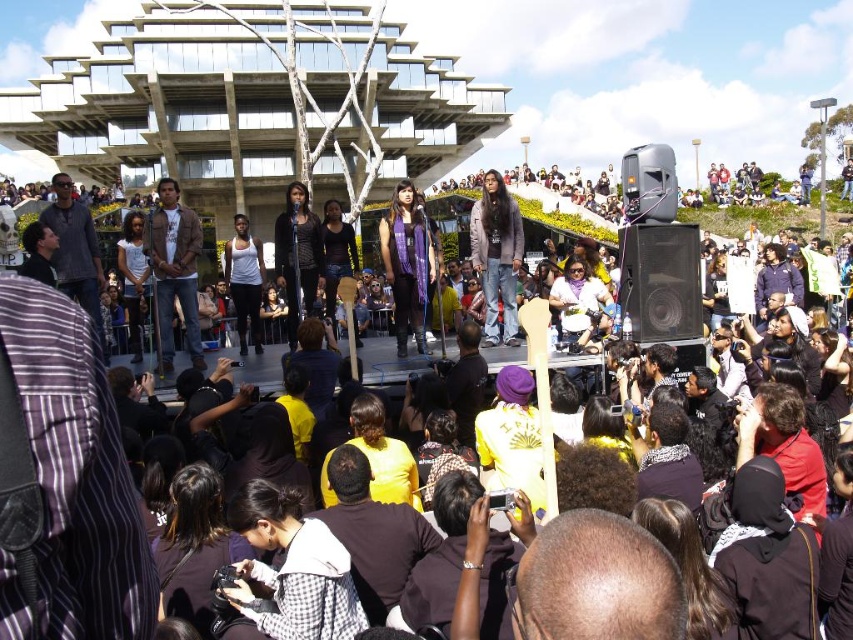
Question: Which of the following is the farthest from the observer?

Choices:
 (A) black matte speaker at center
 (B) purple scarf at center
 (C) brown leather jacket at center

Answer: (B)

Question: Is purple scarf at center closer to the viewer compared to matte black laptop at center?

Choices:
 (A) yes
 (B) no

Answer: (B)

Question: Which point appears closest to the camera in this image?

Choices:
 (A) (686, 296)
 (B) (695, 353)
 (C) (582, 273)
 (D) (521, 246)

Answer: (B)

Question: Which object appears closest to the camera in this image?

Choices:
 (A) matte black laptop at center
 (B) matte purple scarf at center
 (C) matte white shirt at center
 (D) white matte tank top at center

Answer: (A)

Question: Does purple scarf at center come in front of white matte tank top at center?

Choices:
 (A) no
 (B) yes

Answer: (B)

Question: Can you confirm if brown leather jacket at center is positioned to the right of matte black laptop at center?

Choices:
 (A) no
 (B) yes

Answer: (A)